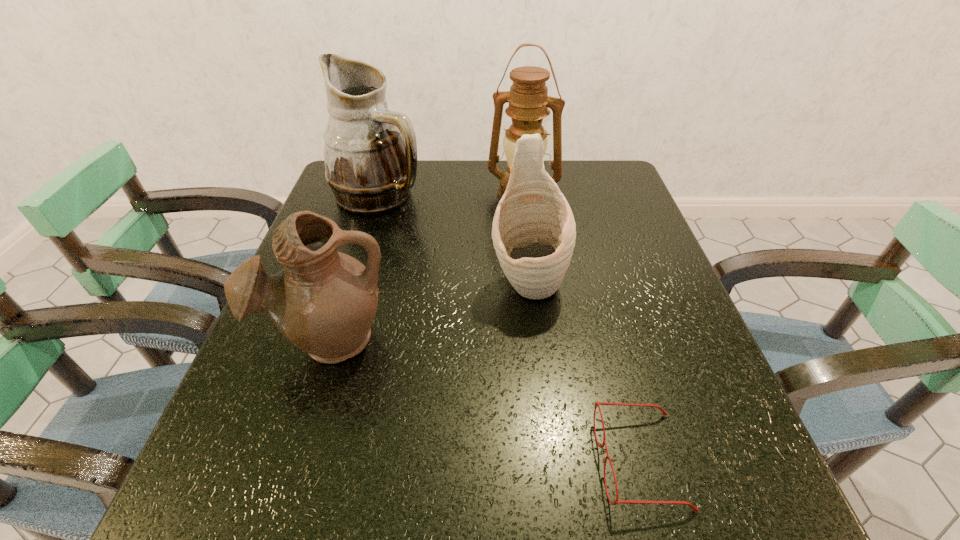
The height and width of the screenshot is (540, 960). In order to click on vacant region at the right edge in this screenshot , I will do pyautogui.click(x=644, y=419).

Identify the location of vacant space at the far right corner of the desktop. (581, 166).

Locate an element on the screen. This screenshot has height=540, width=960. vacant space at the near right corner is located at coordinates (708, 501).

This screenshot has height=540, width=960. I want to click on free area in between the farthest pitcher and the oil lamp, so click(451, 195).

The width and height of the screenshot is (960, 540). Identify the location of vacant area that lies between the farthest pitcher and the oil lamp. (451, 195).

I want to click on unoccupied position between the farthest pitcher and the oil lamp, so click(451, 195).

In order to click on vacant space that's between the farthest pitcher and the rightmost pitcher in this screenshot , I will do `click(454, 239)`.

I want to click on free space between the rightmost pitcher and the fourth tallest object, so click(x=429, y=311).

You are a GUI agent. You are given a task and a screenshot of the screen. Output one action in this format:
    pyautogui.click(x=<x>, y=<y>)
    Task: Click on the unoccupied position between the farthest pitcher and the oil lamp
    The width and height of the screenshot is (960, 540).
    Given the screenshot: What is the action you would take?
    pyautogui.click(x=451, y=195)

Find the location of a particular element. empty space between the shortest pitcher and the rightmost pitcher is located at coordinates (429, 311).